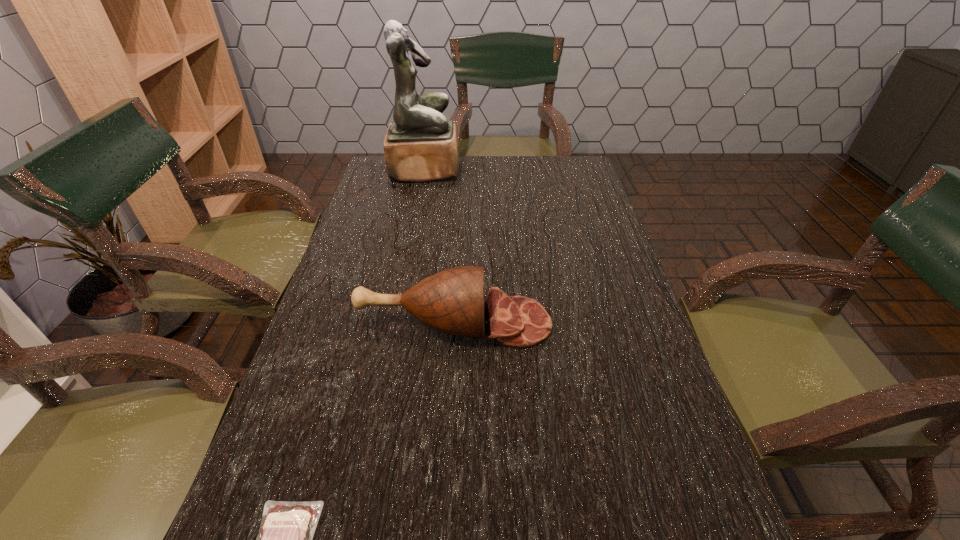
In the image, there is a desktop. Where is `free space at the far edge`? Image resolution: width=960 pixels, height=540 pixels. free space at the far edge is located at coordinates (473, 158).

Where is `vacant space at the left edge`? The height and width of the screenshot is (540, 960). vacant space at the left edge is located at coordinates (363, 226).

In the image, there is a desktop. At what (x,y) coordinates should I click in order to perform the action: click on vacant region at the right edge. Please return your answer as a coordinate pair (x, y). This screenshot has height=540, width=960. Looking at the image, I should click on (610, 318).

Locate an element on the screen. The width and height of the screenshot is (960, 540). vacant space at the far left corner of the desktop is located at coordinates (399, 188).

Identify the location of vacant space at the far right corner of the desktop. The height and width of the screenshot is (540, 960). (545, 168).

Where is `free spot between the farthest object and the second tallest object`? Image resolution: width=960 pixels, height=540 pixels. free spot between the farthest object and the second tallest object is located at coordinates (440, 246).

Image resolution: width=960 pixels, height=540 pixels. What are the coordinates of `object that stands as the closest to the steak` in the screenshot? It's located at (452, 301).

Select which object is the closest to the farthest object. Please provide its 2D coordinates. Your answer should be formatted as a tuple, i.e. [(x, y)], where the tuple contains the x and y coordinates of a point satisfying the conditions above.

[(452, 301)]